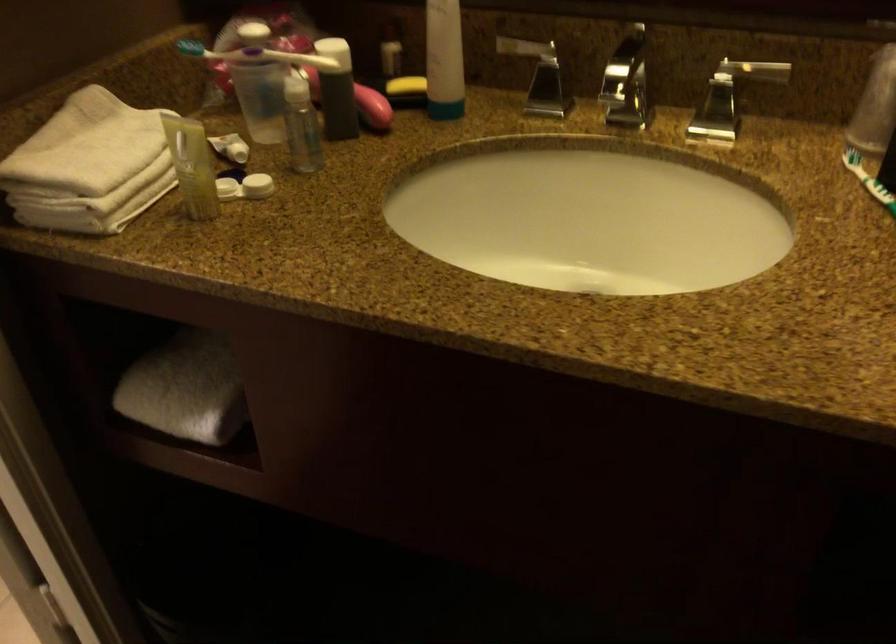
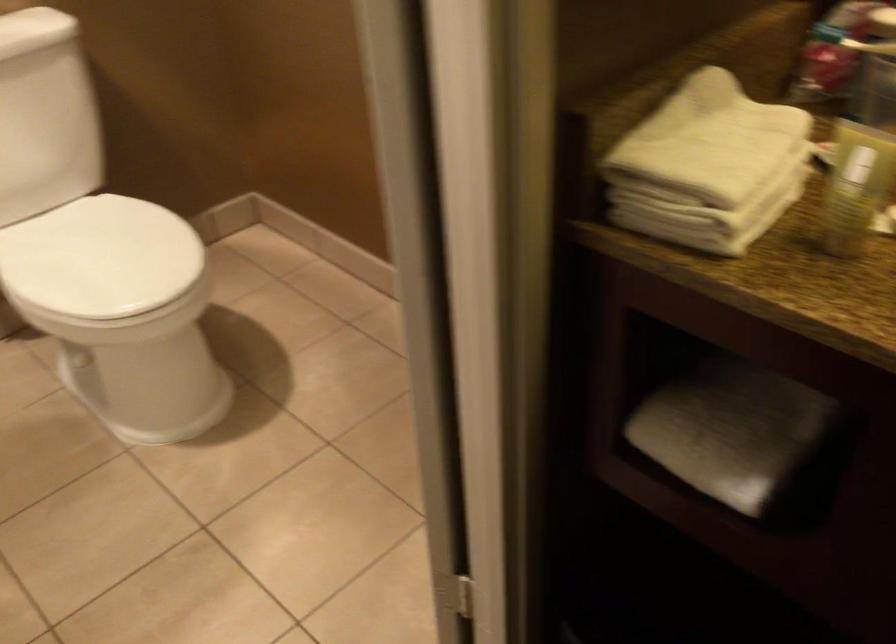
The point at (185, 178) is marked in the first image. Where is the corresponding point in the second image?

(849, 204)